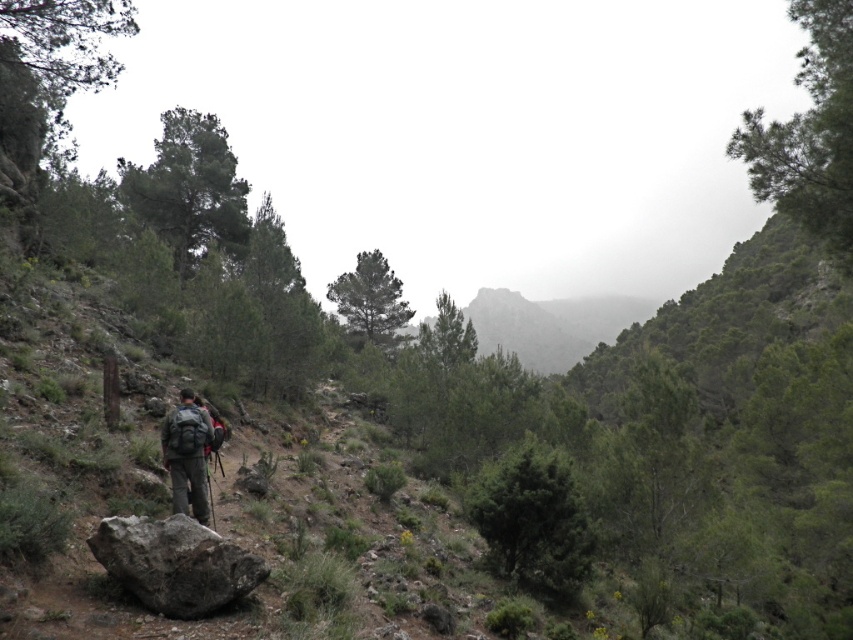
Question: Is gray rough rock at lower left smaller than matte gray backpack at center?

Choices:
 (A) no
 (B) yes

Answer: (A)

Question: Estimate the real-world distances between objects in this image. Which object is farther from the rocky gray mountain at center?

Choices:
 (A) gray rough rock at lower left
 (B) matte gray backpack at center

Answer: (B)

Question: Which object is the closest to the gray rough rock at lower left?

Choices:
 (A) rocky gray mountain at center
 (B) matte gray backpack at center

Answer: (B)

Question: Is gray rough rock at lower left bigger than rocky gray mountain at center?

Choices:
 (A) no
 (B) yes

Answer: (A)

Question: Is rocky gray mountain at center bigger than matte gray backpack at center?

Choices:
 (A) no
 (B) yes

Answer: (B)

Question: Considering the real-world distances, which object is closest to the matte gray backpack at center?

Choices:
 (A) rocky gray mountain at center
 (B) gray rough rock at lower left

Answer: (B)